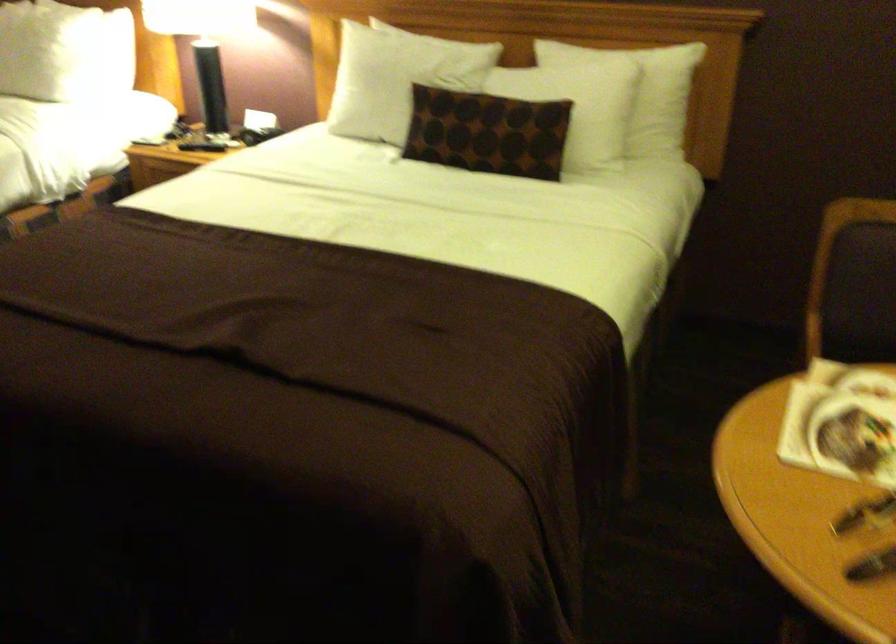
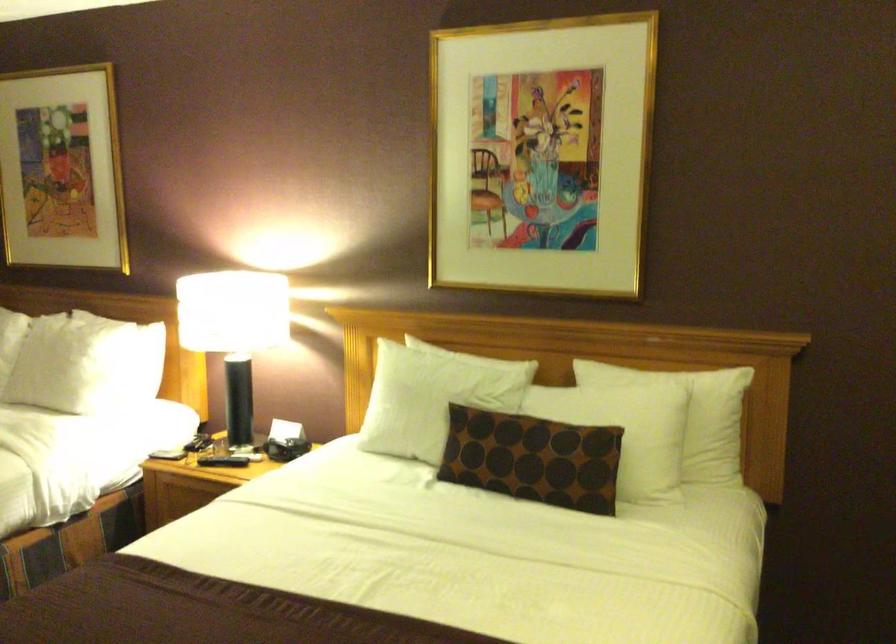
Locate, in the second image, the point that corresponds to pixel 487 131 in the first image.

(532, 458)